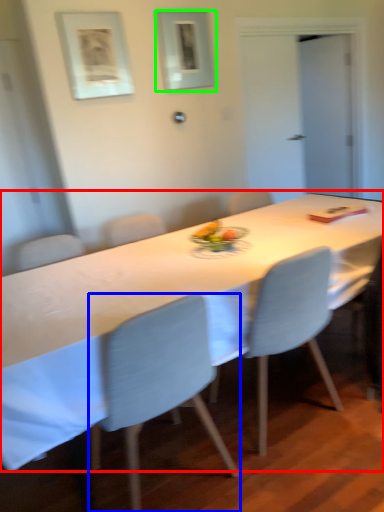
Question: Estimate the real-world distances between objects in this image. Which object is farther from table (highlighted by a red box), chair (highlighted by a blue box) or picture frame (highlighted by a green box)?

Choices:
 (A) chair
 (B) picture frame

Answer: (B)